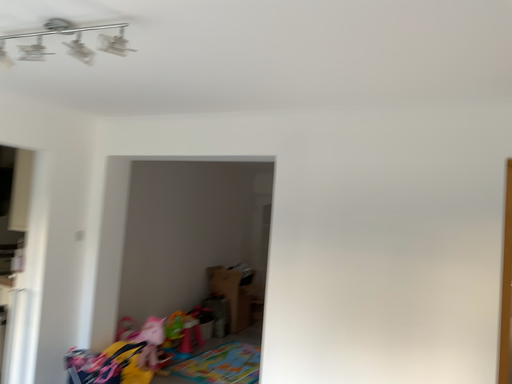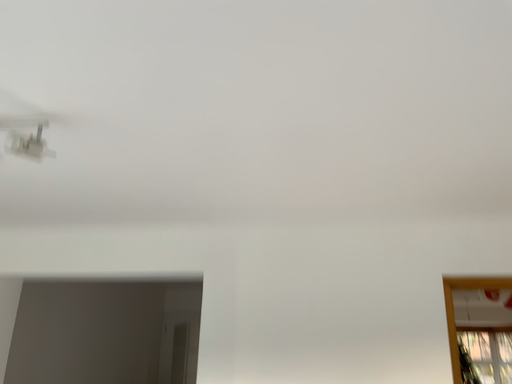
Question: Which way did the camera rotate in the video?

Choices:
 (A) rotated downward
 (B) rotated upward

Answer: (B)